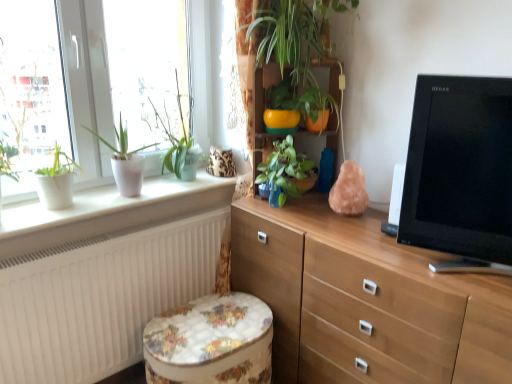
Question: Is clear glass window at upper left positioned with its back to green glossy plant at center, the 3th houseplant positioned from the left?

Choices:
 (A) yes
 (B) no

Answer: (B)

Question: From a real-world perspective, is clear glass window at upper left physically below green glossy plant at center, the 2th houseplant positioned from the right?

Choices:
 (A) yes
 (B) no

Answer: (B)

Question: Is clear glass window at upper left smaller than green glossy plant at center, the 3th houseplant positioned from the left?

Choices:
 (A) no
 (B) yes

Answer: (A)

Question: Is clear glass window at upper left next to green glossy plant at center, the 3th houseplant positioned from the left, and touching it?

Choices:
 (A) no
 (B) yes

Answer: (A)

Question: Is clear glass window at upper left oriented towards green glossy plant at center, the 3th houseplant positioned from the left?

Choices:
 (A) yes
 (B) no

Answer: (B)

Question: Is matte white pot at left, which ranks as the third houseplant in right-to-left order, bigger or smaller than clear glass window at upper left?

Choices:
 (A) big
 (B) small

Answer: (A)

Question: Do you think matte white pot at left, positioned as the 2th houseplant in left-to-right order, is within clear glass window at upper left, or outside of it?

Choices:
 (A) outside
 (B) inside

Answer: (A)

Question: Is point (112, 163) closer or farther from the camera than point (51, 16)?

Choices:
 (A) farther
 (B) closer

Answer: (A)

Question: In terms of height, does matte white pot at left, which ranks as the third houseplant in right-to-left order, look taller or shorter compared to clear glass window at upper left?

Choices:
 (A) tall
 (B) short

Answer: (B)

Question: Relative to white matte plant pot at left, placed as the 4th houseplant when sorted from right to left, is matte white pot at left, which ranks as the third houseplant in right-to-left order, in front or behind?

Choices:
 (A) behind
 (B) front

Answer: (A)

Question: Is matte white pot at left, which ranks as the third houseplant in right-to-left order, wider or thinner than white matte plant pot at left, placed as the 4th houseplant when sorted from right to left?

Choices:
 (A) thin
 (B) wide

Answer: (B)

Question: From the image's perspective, is matte white pot at left, positioned as the 2th houseplant in left-to-right order, positioned above or below white matte plant pot at left, placed as the 4th houseplant when sorted from right to left?

Choices:
 (A) above
 (B) below

Answer: (A)

Question: From a real-world perspective, relative to white matte plant pot at left, the 1th houseplant viewed from the left, is matte white pot at left, positioned as the 2th houseplant in left-to-right order, vertically above or below?

Choices:
 (A) below
 (B) above

Answer: (B)

Question: From the image's perspective, is floral fabric ottoman at lower center above or below light brown wood chest of drawers at center?

Choices:
 (A) below
 (B) above

Answer: (A)

Question: Which is correct: floral fabric ottoman at lower center is inside light brown wood chest of drawers at center, or outside of it?

Choices:
 (A) inside
 (B) outside

Answer: (B)